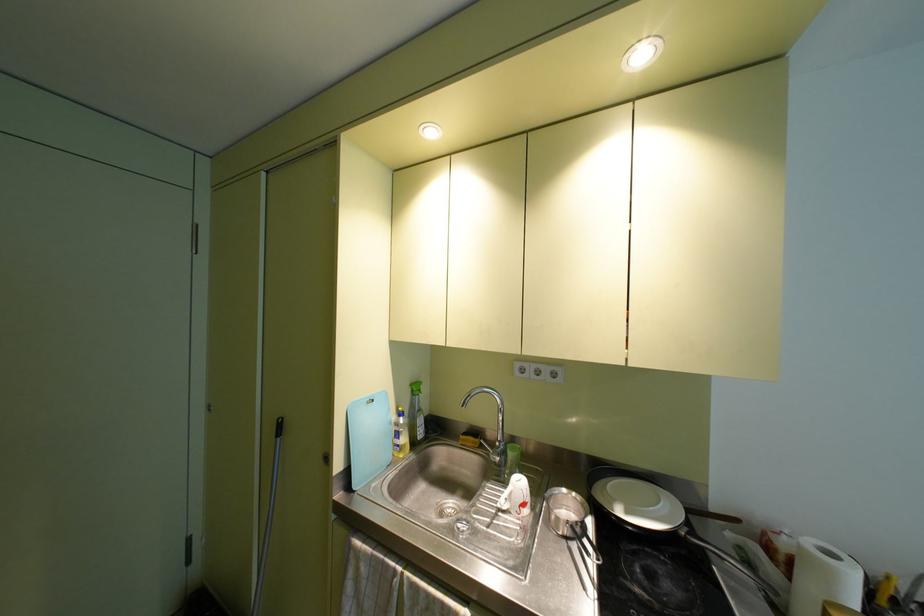
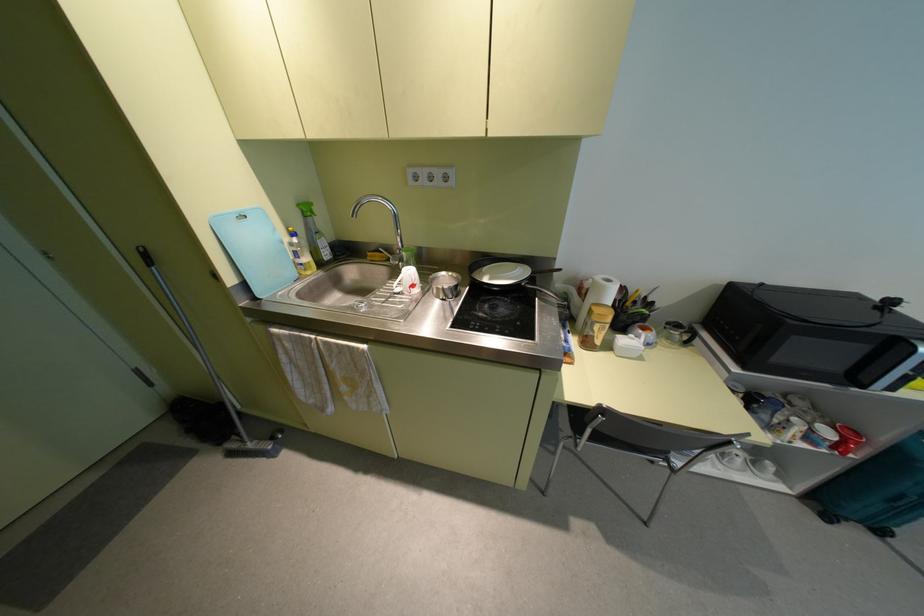
Locate, in the second image, the point that corresponds to (416,392) in the first image.

(308, 214)